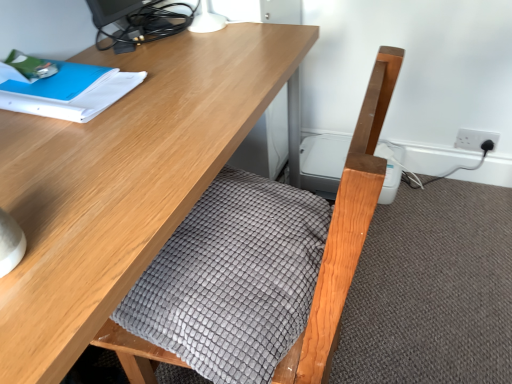
The width and height of the screenshot is (512, 384). I want to click on vacant space to the right of matte black monitor at upper left, so click(x=230, y=41).